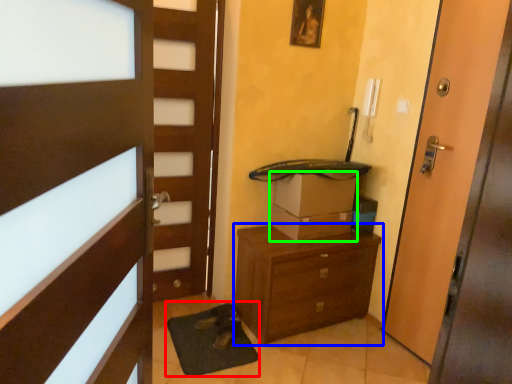
Question: Which object is the farthest from bath mat (highlighted by a red box)? Choose among these: chest of drawers (highlighted by a blue box) or cardboard box (highlighted by a green box).

Choices:
 (A) chest of drawers
 (B) cardboard box

Answer: (B)